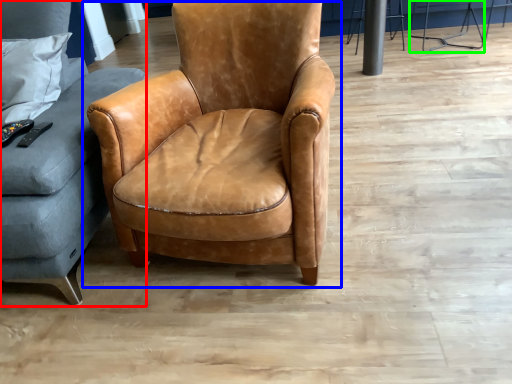
Question: Considering the real-world distances, which object is closest to studio couch (highlighted by a red box)? chair (highlighted by a blue box) or bar stool (highlighted by a green box).

Choices:
 (A) chair
 (B) bar stool

Answer: (A)